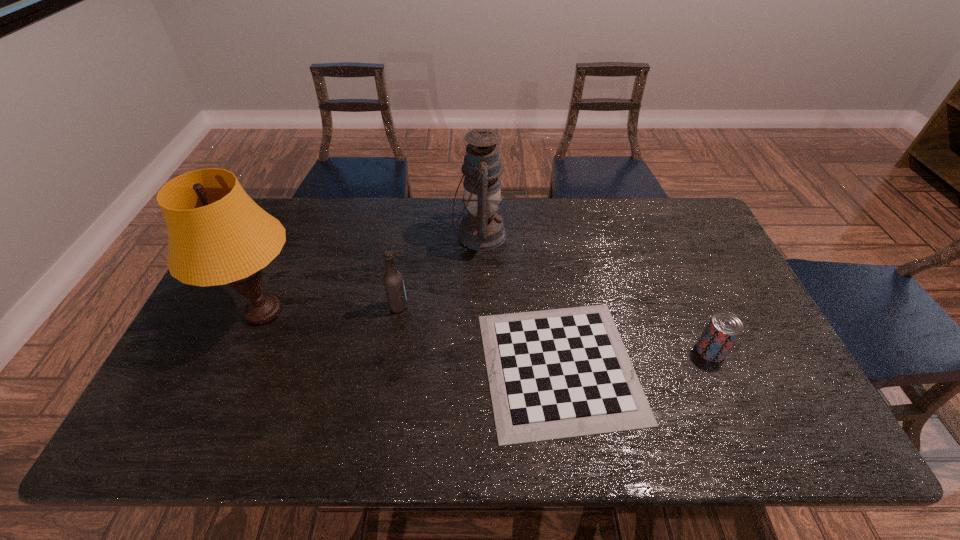
At what (x,y) coordinates should I click in order to perform the action: click on lampshade. Please return your answer as a coordinate pair (x, y). Looking at the image, I should click on (217, 235).

Image resolution: width=960 pixels, height=540 pixels. I want to click on the farthest object, so click(x=481, y=229).

Locate an element on the screen. beer bottle is located at coordinates (393, 281).

You are a GUI agent. You are given a task and a screenshot of the screen. Output one action in this format:
    pyautogui.click(x=<x>, y=<y>)
    Task: Click on the third shortest object
    
    Given the screenshot: What is the action you would take?
    pyautogui.click(x=393, y=281)

This screenshot has height=540, width=960. Identify the location of the rightmost object. (724, 328).

Identify the location of beer can. (724, 328).

The image size is (960, 540). What are the coordinates of `the shortest object` in the screenshot? It's located at (560, 373).

The width and height of the screenshot is (960, 540). Identify the location of blank area located on the back of the lampshade. (285, 264).

Locate an element on the screen. Image resolution: width=960 pixels, height=540 pixels. free space located 0.210m on the left of the farthest object is located at coordinates (390, 235).

This screenshot has width=960, height=540. In order to click on free space located 0.290m on the label of the third tallest object in this screenshot , I will do `click(510, 307)`.